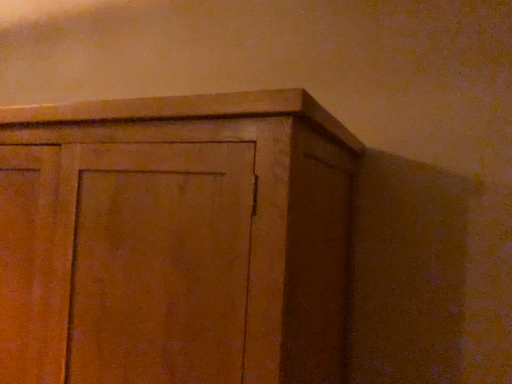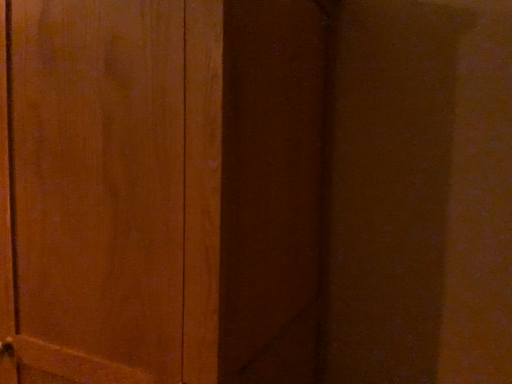
Question: Which way did the camera rotate in the video?

Choices:
 (A) rotated downward
 (B) rotated upward

Answer: (A)